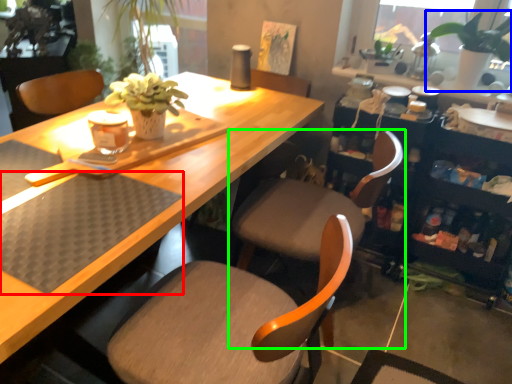
Question: Which object is positioned farthest from wide (highlighted by a red box)? Select from houseplant (highlighted by a blue box) and chair (highlighted by a green box).

Choices:
 (A) houseplant
 (B) chair

Answer: (A)